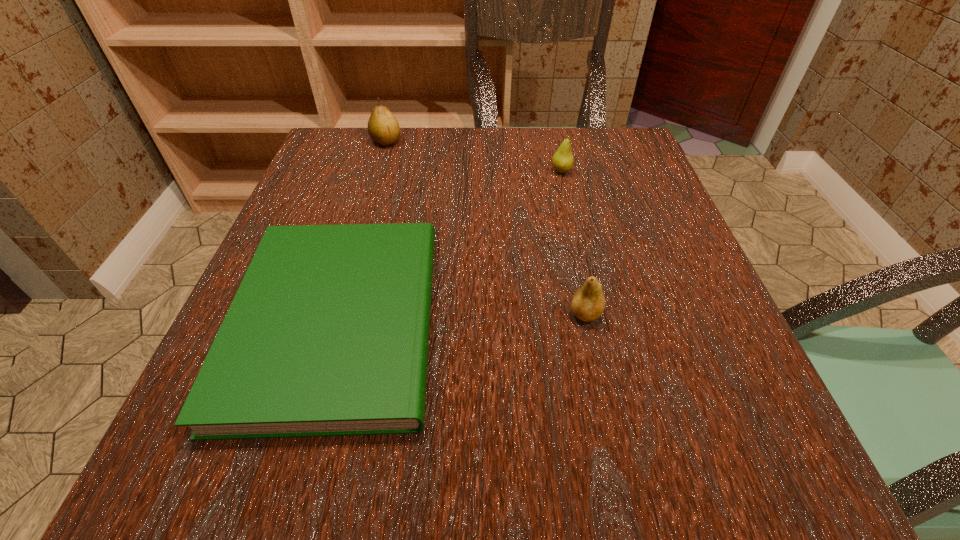
The width and height of the screenshot is (960, 540). I want to click on pear situated at the left edge, so click(383, 128).

Where is `paperback book present at the left edge`? The image size is (960, 540). paperback book present at the left edge is located at coordinates 328,333.

In order to click on object that is at the far left corner in this screenshot , I will do `click(383, 128)`.

This screenshot has width=960, height=540. In order to click on object positioned at the near left corner in this screenshot , I will do `click(328, 333)`.

This screenshot has height=540, width=960. Find the location of `vacant space at the far edge`. vacant space at the far edge is located at coordinates (503, 166).

In the image, there is a desktop. Where is `vacant space at the left edge`? vacant space at the left edge is located at coordinates (366, 193).

In the image, there is a desktop. Where is `vacant region at the right edge`? This screenshot has width=960, height=540. vacant region at the right edge is located at coordinates (656, 213).

This screenshot has height=540, width=960. In the image, there is a desktop. In order to click on vacant space at the far left corner in this screenshot , I will do `click(328, 139)`.

At what (x,y) coordinates should I click in order to perform the action: click on vacant space at the far right corner of the desktop. Please return your answer as a coordinate pair (x, y). This screenshot has width=960, height=540. Looking at the image, I should click on (650, 182).

Image resolution: width=960 pixels, height=540 pixels. In order to click on vacant space at the near right corner in this screenshot , I will do `click(654, 434)`.